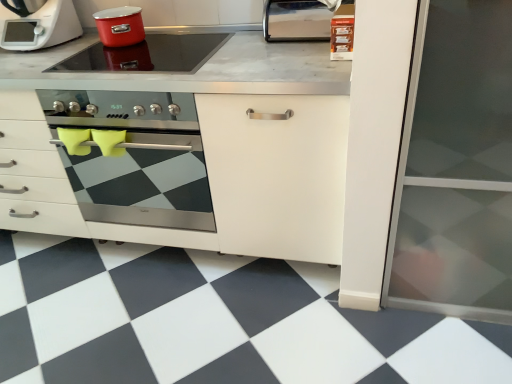
This screenshot has width=512, height=384. Describe the element at coordinates (147, 54) in the screenshot. I see `smooth glass cooktop at upper center, which is the first kitchen appliance in bottom-to-top order` at that location.

In order to click on white matte cabinet at center in this screenshot , I will do `click(184, 150)`.

Measure the distance between white matte food processor at upper left and camera.

The distance of white matte food processor at upper left from camera is 1.69 meters.

What do you see at coordinates (296, 20) in the screenshot? I see `satin silver paper towel dispenser at upper right` at bounding box center [296, 20].

Locate an element on the screen. stainless steel oven at center is located at coordinates (137, 158).

How far apart are white matte food processor at upper left and smooth glass cooktop at upper center, which is the first kitchen appliance in bottom-to-top order?

white matte food processor at upper left is 26.47 centimeters away from smooth glass cooktop at upper center, which is the first kitchen appliance in bottom-to-top order.

Which is more to the right, white matte food processor at upper left or smooth glass cooktop at upper center, the 2th kitchen appliance positioned from the top?

From the viewer's perspective, smooth glass cooktop at upper center, the 2th kitchen appliance positioned from the top, appears more on the right side.

Can you tell me how much white matte food processor at upper left and smooth glass cooktop at upper center, which is the first kitchen appliance in bottom-to-top order, differ in facing direction?

The angular difference between white matte food processor at upper left and smooth glass cooktop at upper center, which is the first kitchen appliance in bottom-to-top order, is 0.0018 degrees.

Are white matte food processor at upper left and smooth glass cooktop at upper center, which is the first kitchen appliance in bottom-to-top order, far apart?

white matte food processor at upper left is actually quite close to smooth glass cooktop at upper center, which is the first kitchen appliance in bottom-to-top order.

Considering their positions, is satin silver paper towel dispenser at upper right located in front of or behind white matte cabinet at center?

Visually, satin silver paper towel dispenser at upper right is located behind white matte cabinet at center.

Which of these two, satin silver paper towel dispenser at upper right or white matte cabinet at center, is thinner?

Thinner between the two is satin silver paper towel dispenser at upper right.

Based on the photo, how many degrees apart are the facing directions of satin silver paper towel dispenser at upper right and white matte cabinet at center?

They differ by 0.293 degrees in their facing directions.

From the image's perspective, between satin silver paper towel dispenser at upper right and white matte cabinet at center, which one is located above?

satin silver paper towel dispenser at upper right is shown above in the image.

Considering the sizes of objects smooth glass cooktop at upper center, the 2th kitchen appliance positioned from the top, and black/white checkered tile at lower center in the image provided, who is thinner, smooth glass cooktop at upper center, the 2th kitchen appliance positioned from the top, or black/white checkered tile at lower center?

Thinner between the two is smooth glass cooktop at upper center, the 2th kitchen appliance positioned from the top.

Would you consider smooth glass cooktop at upper center, the 2th kitchen appliance positioned from the top, to be distant from black/white checkered tile at lower center?

smooth glass cooktop at upper center, the 2th kitchen appliance positioned from the top, is actually quite close to black/white checkered tile at lower center.

Is black/white checkered tile at lower center at the back of smooth glass cooktop at upper center, which is the first kitchen appliance in bottom-to-top order?

No, smooth glass cooktop at upper center, which is the first kitchen appliance in bottom-to-top order, is not facing away from black/white checkered tile at lower center.

Is white matte cabinet at center looking in the opposite direction of smooth glass cooktop at upper center, the 2th kitchen appliance positioned from the top?

No.

Between point (28, 130) and point (98, 62), which one is positioned behind?

The point (98, 62) is farther from the camera.

Which is more to the left, white matte cabinet at center or smooth glass cooktop at upper center, the 2th kitchen appliance positioned from the top?

From the viewer's perspective, white matte cabinet at center appears more on the left side.

Is white matte cabinet at center far away from smooth glass cooktop at upper center, which is the first kitchen appliance in bottom-to-top order?

No, white matte cabinet at center is not far away from smooth glass cooktop at upper center, which is the first kitchen appliance in bottom-to-top order.

What's the angular difference between stainless steel oven at center and white matte cabinet at center's facing directions?

0.294 degrees.

Can you confirm if stainless steel oven at center is positioned to the right of white matte cabinet at center?

Indeed, stainless steel oven at center is positioned on the right side of white matte cabinet at center.

From the image's perspective, is stainless steel oven at center over white matte cabinet at center?

Yes, from the image's perspective, stainless steel oven at center is on top of white matte cabinet at center.

Is stainless steel oven at center directly adjacent to white matte cabinet at center?

No, stainless steel oven at center is not making contact with white matte cabinet at center.

Considering the positions of point (190, 53) and point (139, 105), is point (190, 53) closer or farther from the camera than point (139, 105)?

Point (190, 53).

Looking at this image, which is correct: smooth glass cooktop at upper center, which is the first kitchen appliance in bottom-to-top order, is inside stainless steel oven at center, or outside of it?

smooth glass cooktop at upper center, which is the first kitchen appliance in bottom-to-top order, is not enclosed by stainless steel oven at center.

From the picture: Which of these two, smooth glass cooktop at upper center, which is the first kitchen appliance in bottom-to-top order, or stainless steel oven at center, stands shorter?

Standing shorter between the two is smooth glass cooktop at upper center, which is the first kitchen appliance in bottom-to-top order.

Is smooth glass cooktop at upper center, the 2th kitchen appliance positioned from the top, at the left side of stainless steel oven at center?

Yes.

From the image's perspective, is white matte cabinet at center above or below satin silver paper towel dispenser at upper right?

Based on their image positions, white matte cabinet at center is located beneath satin silver paper towel dispenser at upper right.

How far apart are white matte cabinet at center and satin silver paper towel dispenser at upper right?

white matte cabinet at center and satin silver paper towel dispenser at upper right are 19.94 inches apart from each other.

Can you confirm if white matte cabinet at center is shorter than satin silver paper towel dispenser at upper right?

In fact, white matte cabinet at center may be taller than satin silver paper towel dispenser at upper right.

What's the angular difference between white matte cabinet at center and satin silver paper towel dispenser at upper right's facing directions?

0.293 degrees separate the facing orientations of white matte cabinet at center and satin silver paper towel dispenser at upper right.

From a real-world perspective, count 2nd kitchen appliances downward from the white matte food processor at upper left and point to it. Please provide its 2D coordinates.

[(147, 54)]

Locate an element on the screen. The image size is (512, 384). cabinetry that appears in front of the satin silver paper towel dispenser at upper right is located at coordinates (184, 150).

When comparing their distances from smooth glass cooktop at upper center, the 2th kitchen appliance positioned from the top, does white matte food processor at upper left or white matte cabinet at center seem closer?

white matte food processor at upper left is positioned closer to the anchor smooth glass cooktop at upper center, the 2th kitchen appliance positioned from the top.

Considering their positions, is white matte cabinet at center positioned closer to smooth glass cooktop at upper center, the 2th kitchen appliance positioned from the top, than white matte food processor at upper left?

white matte food processor at upper left.

Looking at the image, which one is located closer to white matte cabinet at center, satin silver paper towel dispenser at upper right or stainless steel oven at center?

stainless steel oven at center.

Considering their positions, is white matte food processor at upper left positioned further to stainless steel oven at center than smooth glass cooktop at upper center, the 2th kitchen appliance positioned from the top?

The object further to stainless steel oven at center is white matte food processor at upper left.

Considering their positions, is white matte food processor at upper left positioned closer to stainless steel oven at center than black/white checkered tile at lower center?

The object closer to stainless steel oven at center is black/white checkered tile at lower center.

Considering their positions, is satin silver paper towel dispenser at upper right positioned closer to white matte cabinet at center than matte red pot at upper center, which is the 1th kitchen appliance from top to bottom?

satin silver paper towel dispenser at upper right is positioned closer to the anchor white matte cabinet at center.

Which object lies nearer to the anchor point black/white checkered tile at lower center, white matte food processor at upper left or white matte cabinet at center?

Based on the image, white matte cabinet at center appears to be nearer to black/white checkered tile at lower center.

Estimate the real-world distances between objects in this image. Which object is closer to matte red pot at upper center, the second kitchen appliance positioned from the bottom, white matte cabinet at center or smooth glass cooktop at upper center, the 2th kitchen appliance positioned from the top?

smooth glass cooktop at upper center, the 2th kitchen appliance positioned from the top, lies closer to matte red pot at upper center, the second kitchen appliance positioned from the bottom, than the other object.

Identify the location of oven between matte red pot at upper center, the second kitchen appliance positioned from the bottom, and black/white checkered tile at lower center, in the vertical direction. (137, 158).

Identify the location of oven between white matte food processor at upper left and black/white checkered tile at lower center in the up-down direction. (137, 158).

The width and height of the screenshot is (512, 384). What are the coordinates of `oven that lies between smooth glass cooktop at upper center, which is the first kitchen appliance in bottom-to-top order, and black/white checkered tile at lower center from top to bottom` in the screenshot? It's located at (137, 158).

Find the location of a particular element. This screenshot has height=384, width=512. oven between white matte cabinet at center and satin silver paper towel dispenser at upper right is located at coordinates pyautogui.click(x=137, y=158).